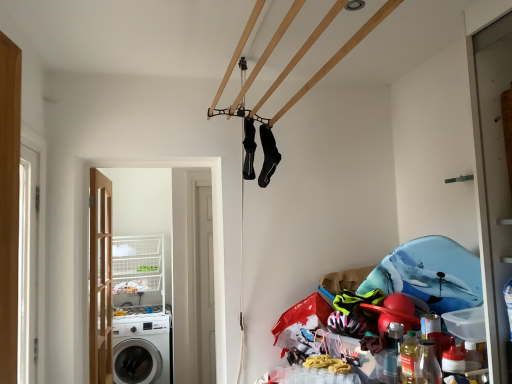
In order to face white glossy washing machine at lower left, should I rotate leftwards or rightwards?

To face it directly, rotate left by 15.303 degrees.

At what (x,y) coordinates should I click in order to perform the action: click on wooden door at left. Please return your answer as a coordinate pair (x, y). The height and width of the screenshot is (384, 512). Looking at the image, I should click on (100, 279).

Measure the distance between wooden door at left and camera.

wooden door at left is 2.54 meters from camera.

Measure the distance between point (154, 250) and camera.

They are 4.16 meters apart.

You are a GUI agent. You are given a task and a screenshot of the screen. Output one action in this format:
    pyautogui.click(x=<x>, y=<y>)
    Task: Click on the white glossy washing machine at lower left
    This screenshot has width=512, height=384.
    Given the screenshot: What is the action you would take?
    pyautogui.click(x=141, y=348)

Does point (277, 162) lie behind point (248, 117)?

Yes, it is.

How distant is black matte socks at upper center, marked as the 2th clothing in a left-to-right arrangement, from black matte socks at center, the 1th clothing viewed from the left?

12.11 inches.

Does black matte socks at upper center, marked as the 1th clothing in a right-to-left arrangement, appear on the right side of black matte socks at center, the 1th clothing viewed from the left?

Indeed, black matte socks at upper center, marked as the 1th clothing in a right-to-left arrangement, is positioned on the right side of black matte socks at center, the 1th clothing viewed from the left.

From the picture: Are black matte socks at upper center, marked as the 2th clothing in a left-to-right arrangement, and black matte socks at center, the second clothing in the right-to-left sequence, far apart?

No, black matte socks at upper center, marked as the 2th clothing in a left-to-right arrangement, is not far away from black matte socks at center, the second clothing in the right-to-left sequence.

From a real-world perspective, is white plastic laundry basket at left above or below wooden door at left?

white plastic laundry basket at left is above wooden door at left.

Who is smaller, white plastic laundry basket at left or wooden door at left?

With smaller size is wooden door at left.

From the image's perspective, would you say white plastic laundry basket at left is shown under wooden door at left?

No, from the image's perspective, white plastic laundry basket at left is not beneath wooden door at left.

From a real-world perspective, who is located lower, white plastic laundry basket at left or black matte socks at upper center, marked as the 1th clothing in a right-to-left arrangement?

white plastic laundry basket at left.

Does point (176, 339) come closer to viewer compared to point (276, 162)?

No.

In order to click on clothing that is the 1st object located in front of the white plastic laundry basket at left in this screenshot , I will do `click(268, 155)`.

Who is more distant, white plastic laundry basket at left or black matte socks at upper center, marked as the 1th clothing in a right-to-left arrangement?

white plastic laundry basket at left is further away from the camera.

Can you tell me how much white plastic laundry basket at left and black matte socks at center, the 1th clothing viewed from the left, differ in facing direction?

The angular difference between white plastic laundry basket at left and black matte socks at center, the 1th clothing viewed from the left, is 93.2 degrees.

Which of these two, white plastic laundry basket at left or black matte socks at center, the 1th clothing viewed from the left, is thinner?

black matte socks at center, the 1th clothing viewed from the left, is thinner.

Could black matte socks at center, the 1th clothing viewed from the left, be considered to be inside white plastic laundry basket at left?

No, black matte socks at center, the 1th clothing viewed from the left, is located outside of white plastic laundry basket at left.

Is there a large distance between white plastic laundry basket at left and black matte socks at center, the 1th clothing viewed from the left?

Yes, white plastic laundry basket at left is far from black matte socks at center, the 1th clothing viewed from the left.

Can white plastic laundry basket at left be found inside white wire basket at lower left?

That's incorrect, white plastic laundry basket at left is not inside white wire basket at lower left.

From the image's perspective, between white wire basket at lower left and white plastic laundry basket at left, which one is located above?

white plastic laundry basket at left appears higher in the image.

Is white wire basket at lower left facing towards white plastic laundry basket at left?

Yes, white wire basket at lower left is turned towards white plastic laundry basket at left.

The image size is (512, 384). I want to click on washing machine below the white plastic laundry basket at left (from a real-world perspective), so click(x=141, y=348).

Is white glossy washing machine at lower left oriented towards white plastic laundry basket at left?

Yes, white glossy washing machine at lower left is turned towards white plastic laundry basket at left.

Is white glossy washing machine at lower left smaller than white plastic laundry basket at left?

Incorrect, white glossy washing machine at lower left is not smaller in size than white plastic laundry basket at left.

Is there a large distance between white glossy washing machine at lower left and white plastic laundry basket at left?

No, white glossy washing machine at lower left is in close proximity to white plastic laundry basket at left.

This screenshot has width=512, height=384. In order to click on the 2nd clothing positioned above the white glossy washing machine at lower left (from the image's perspective) in this screenshot , I will do `click(249, 148)`.

Is black matte socks at center, the second clothing in the right-to-left sequence, in contact with white glossy washing machine at lower left?

No, black matte socks at center, the second clothing in the right-to-left sequence, is not making contact with white glossy washing machine at lower left.

Is black matte socks at center, the second clothing in the right-to-left sequence, oriented towards white glossy washing machine at lower left?

No, black matte socks at center, the second clothing in the right-to-left sequence, is not aimed at white glossy washing machine at lower left.

Between black matte socks at center, the 1th clothing viewed from the left, and white glossy washing machine at lower left, which one has smaller width?

black matte socks at center, the 1th clothing viewed from the left, is thinner.

Locate an element on the screen. clothing that is in front of the black matte socks at upper center, marked as the 2th clothing in a left-to-right arrangement is located at coordinates (249, 148).

Where is `door located on the left of white plastic laundry basket at left`? door located on the left of white plastic laundry basket at left is located at coordinates (100, 279).

Which object lies nearer to the anchor point black matte socks at center, the second clothing in the right-to-left sequence, black matte socks at upper center, marked as the 2th clothing in a left-to-right arrangement, or white wire basket at lower left?

black matte socks at upper center, marked as the 2th clothing in a left-to-right arrangement.

Which object lies further to the anchor point black matte socks at upper center, marked as the 2th clothing in a left-to-right arrangement, white plastic laundry basket at left or white wire basket at lower left?

white wire basket at lower left is positioned further to the anchor black matte socks at upper center, marked as the 2th clothing in a left-to-right arrangement.

From the image, which object appears to be farther from white glossy washing machine at lower left, black matte socks at center, the 1th clothing viewed from the left, or white plastic laundry basket at left?

The object further to white glossy washing machine at lower left is black matte socks at center, the 1th clothing viewed from the left.

Considering their positions, is wooden door at left positioned closer to white plastic laundry basket at left than black matte socks at upper center, marked as the 2th clothing in a left-to-right arrangement?

The object closer to white plastic laundry basket at left is wooden door at left.

Looking at the image, which one is located closer to white wire basket at lower left, black matte socks at upper center, marked as the 2th clothing in a left-to-right arrangement, or white plastic laundry basket at left?

Based on the image, white plastic laundry basket at left appears to be nearer to white wire basket at lower left.

Estimate the real-world distances between objects in this image. Which object is closer to black matte socks at upper center, marked as the 2th clothing in a left-to-right arrangement, white glossy washing machine at lower left or black matte socks at center, the second clothing in the right-to-left sequence?

black matte socks at center, the second clothing in the right-to-left sequence, is positioned closer to the anchor black matte socks at upper center, marked as the 2th clothing in a left-to-right arrangement.

Which object lies further to the anchor point black matte socks at center, the second clothing in the right-to-left sequence, wooden door at left or white plastic laundry basket at left?

The object further to black matte socks at center, the second clothing in the right-to-left sequence, is white plastic laundry basket at left.

Looking at the image, which one is located closer to white plastic laundry basket at left, black matte socks at center, the second clothing in the right-to-left sequence, or black matte socks at upper center, marked as the 1th clothing in a right-to-left arrangement?

Based on the image, black matte socks at upper center, marked as the 1th clothing in a right-to-left arrangement, appears to be nearer to white plastic laundry basket at left.

This screenshot has height=384, width=512. I want to click on screen door that lies between black matte socks at center, the second clothing in the right-to-left sequence, and white glossy washing machine at lower left from top to bottom, so click(177, 248).

I want to click on washing machine between white plastic laundry basket at left and white wire basket at lower left in the front-back direction, so click(x=141, y=348).

The width and height of the screenshot is (512, 384). Identify the location of door between black matte socks at upper center, marked as the 2th clothing in a left-to-right arrangement, and white wire basket at lower left from front to back. (100, 279).

Locate an element on the screen. clothing between black matte socks at center, the 1th clothing viewed from the left, and white glossy washing machine at lower left vertically is located at coordinates (268, 155).